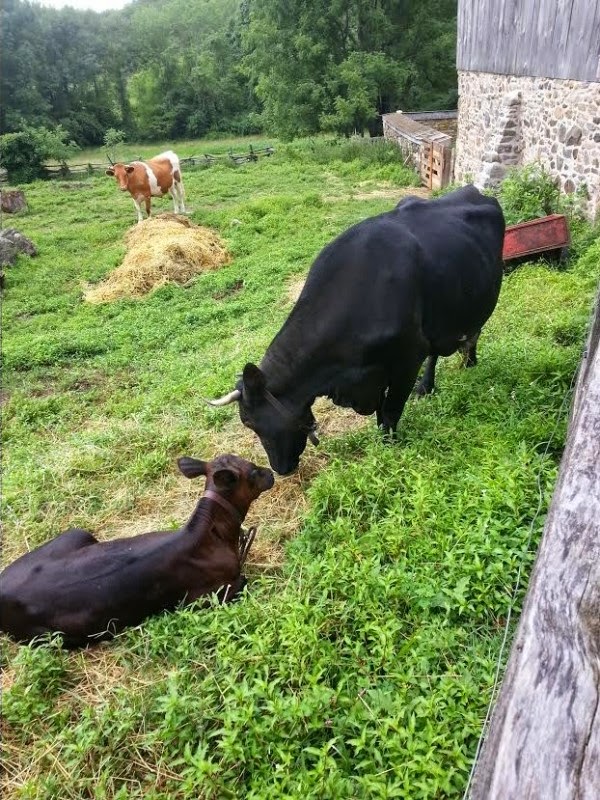
Where is `wall`? wall is located at coordinates (430, 136).